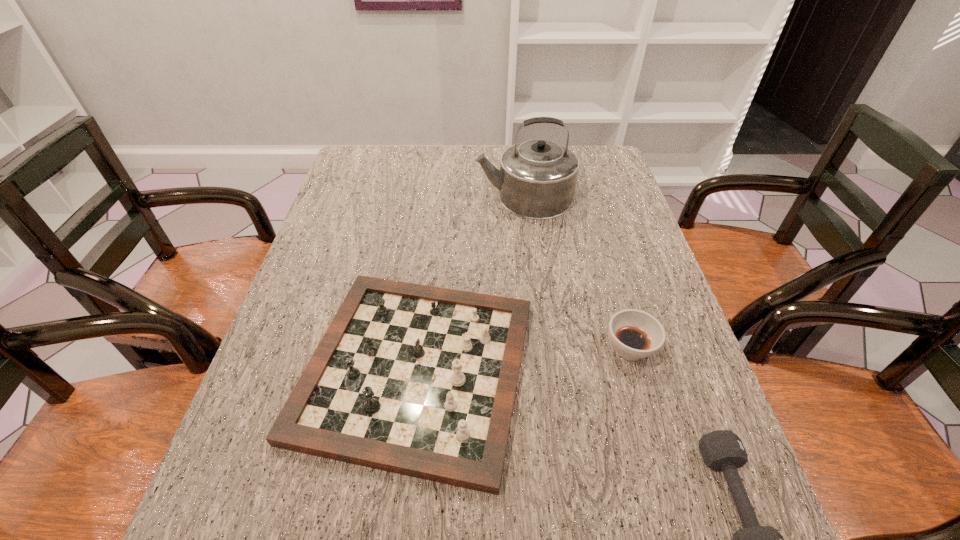
Where is `the tallest object`? This screenshot has height=540, width=960. the tallest object is located at coordinates (537, 178).

What are the coordinates of `kettle` in the screenshot? It's located at (537, 178).

Locate an element on the screen. chessboard is located at coordinates (417, 380).

At what (x,y) coordinates should I click in order to perform the action: click on soup bowl. Please return your answer as a coordinate pair (x, y). Looking at the image, I should click on (635, 334).

I want to click on vacant space located 0.370m with the spout at the front of the kettle, so click(x=355, y=197).

At what (x,y) coordinates should I click in order to perform the action: click on vacant space located 0.210m with the spout at the front of the kettle. Please return your answer as a coordinate pair (x, y). The height and width of the screenshot is (540, 960). Looking at the image, I should click on (407, 197).

The width and height of the screenshot is (960, 540). Find the location of `vacant position located with the spout at the front of the kettle`. vacant position located with the spout at the front of the kettle is located at coordinates (391, 197).

This screenshot has height=540, width=960. In order to click on vacant area located 0.220m on the right of the third shortest object in this screenshot , I will do `click(641, 369)`.

I want to click on vacant space located on the back of the soup bowl, so [x=607, y=270].

The height and width of the screenshot is (540, 960). I want to click on object that is at the far edge, so (537, 178).